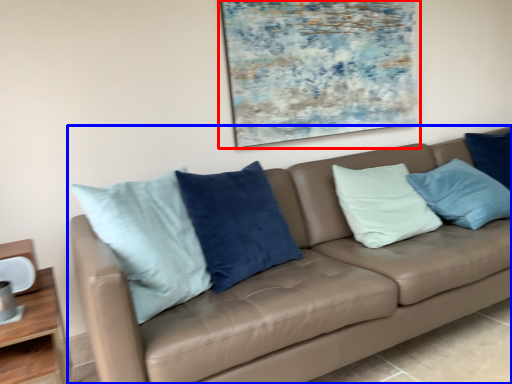
Question: Which object appears farthest to the camera in this image, picture frame (highlighted by a red box) or studio couch (highlighted by a blue box)?

Choices:
 (A) picture frame
 (B) studio couch

Answer: (A)